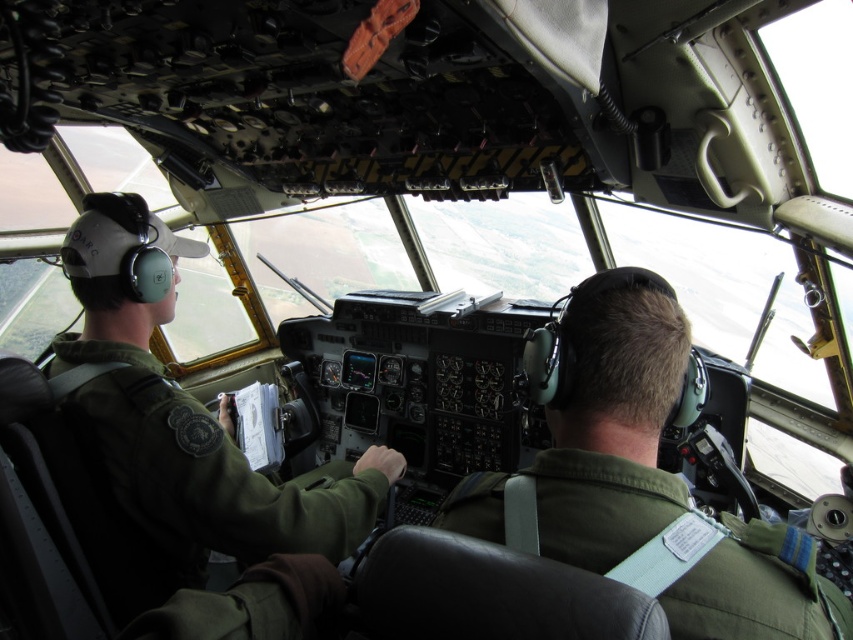
Question: Which object appears farthest from the camera in this image?

Choices:
 (A) green fabric pilot at center
 (B) green fabric uniform at left

Answer: (B)

Question: Among these points, which one is farthest from the camera?

Choices:
 (A) (190, 412)
 (B) (796, 621)

Answer: (A)

Question: Among these objects, which one is nearest to the camera?

Choices:
 (A) green fabric pilot at center
 (B) green fabric uniform at left

Answer: (A)

Question: Considering the relative positions of green fabric pilot at center and green fabric uniform at left in the image provided, where is green fabric pilot at center located with respect to green fabric uniform at left?

Choices:
 (A) right
 (B) left

Answer: (A)

Question: Does green fabric pilot at center have a greater width compared to green fabric uniform at left?

Choices:
 (A) yes
 (B) no

Answer: (B)

Question: Does green fabric pilot at center have a greater width compared to green fabric uniform at left?

Choices:
 (A) no
 (B) yes

Answer: (A)